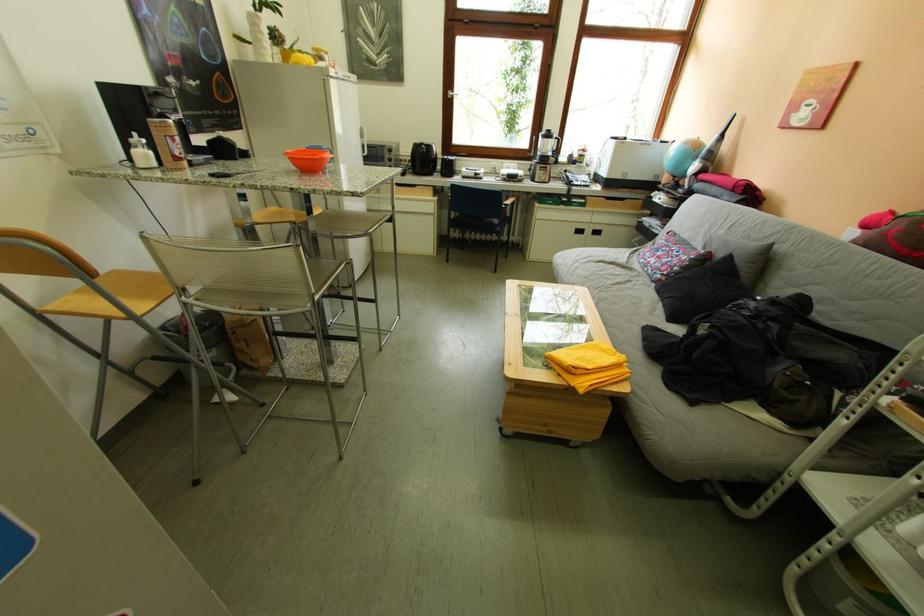
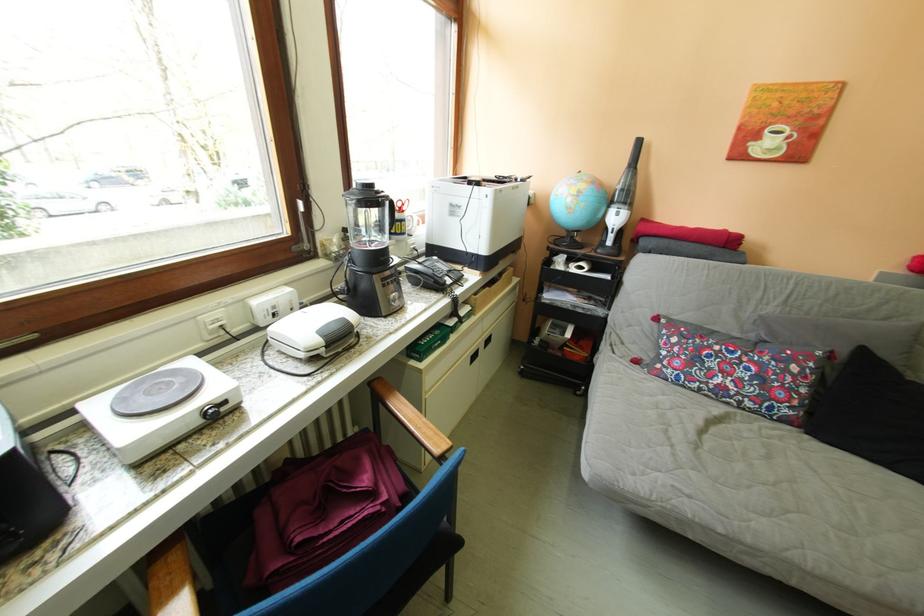
Locate, in the second image, the point that corresponds to point 699,188 in the first image.

(622, 246)